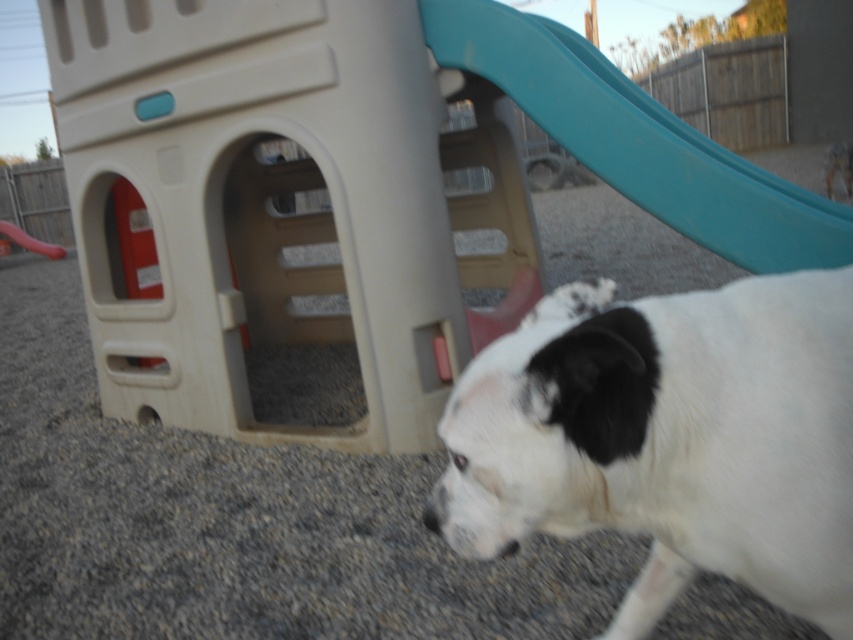
You are a parent trying to locate your child who is playing in the playground. You see the gray gravel at center and the white fur dog at lower right. Which object is closer to you?

The gray gravel at center is positioned over white fur dog at lower right, meaning the gray gravel at center is closer to you.

You are standing at the playground and want to know which of the two points, point (x=840, y=609) or point (x=42, y=252), is closer to you. Based on the scene, can you determine which one is nearer?

Point (x=840, y=609) is closer to the viewer than point (x=42, y=252).